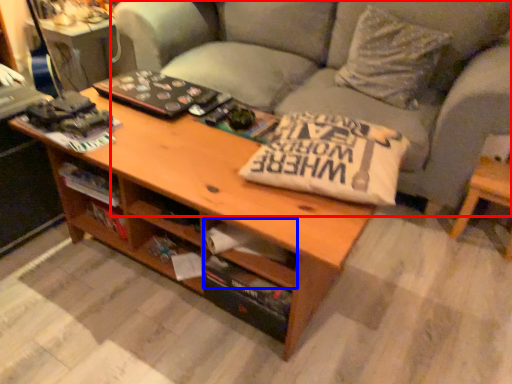
Question: Among these objects, which one is farthest to the camera, studio couch (highlighted by a red box) or drawer (highlighted by a blue box)?

Choices:
 (A) studio couch
 (B) drawer

Answer: (A)